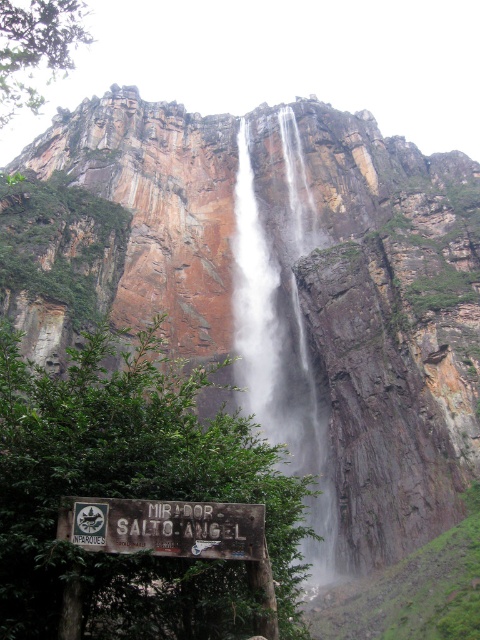
Can you confirm if white misty waterfall at center is smaller than weathered wood sign at lower center?

No.

Does point (274, 323) come closer to viewer compared to point (172, 515)?

That is False.

Locate an element on the screen. This screenshot has height=640, width=480. white misty waterfall at center is located at coordinates (280, 332).